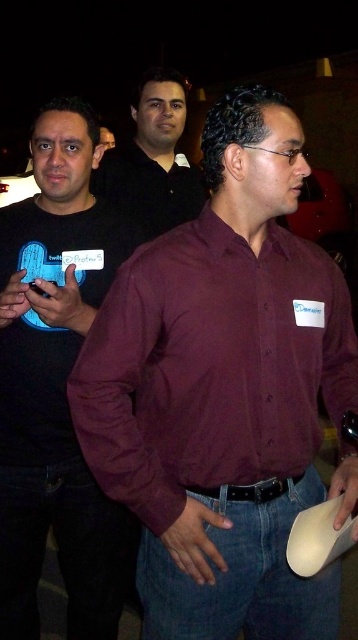
Can you confirm if maroon smooth shirt at center is positioned to the left of matte black shirt at center?

No, maroon smooth shirt at center is not to the left of matte black shirt at center.

What do you see at coordinates (211, 365) in the screenshot?
I see `maroon smooth shirt at center` at bounding box center [211, 365].

Does point (287, 381) lie in front of point (194, 188)?

Yes, it is.

Find the location of `maroon smooth shirt at center`. maroon smooth shirt at center is located at coordinates (211, 365).

Is matte black shirt at left thinner than matte black shirt at center?

Yes.

Between matte black shirt at left and matte black shirt at center, which one has less height?

With less height is matte black shirt at center.

Locate an element on the screen. matte black shirt at left is located at coordinates (55, 384).

Who is more distant from viewer, (281, 380) or (23, 232)?

The point (23, 232) is more distant.

Does maroon smooth shirt at center have a greater height compared to matte black shirt at left?

In fact, maroon smooth shirt at center may be shorter than matte black shirt at left.

The image size is (358, 640). Describe the element at coordinates (211, 365) in the screenshot. I see `maroon smooth shirt at center` at that location.

You are a GUI agent. You are given a task and a screenshot of the screen. Output one action in this format:
    pyautogui.click(x=<x>, y=<y>)
    Task: Click on the maroon smooth shirt at center
    
    Given the screenshot: What is the action you would take?
    pyautogui.click(x=211, y=365)